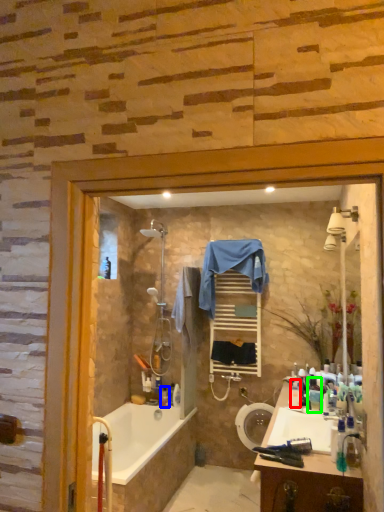
Question: Estimate the real-world distances between objects in this image. Which object is farther from toiletry (highlighted by a red box), toiletry (highlighted by a blue box) or toiletry (highlighted by a green box)?

Choices:
 (A) toiletry
 (B) toiletry

Answer: (A)